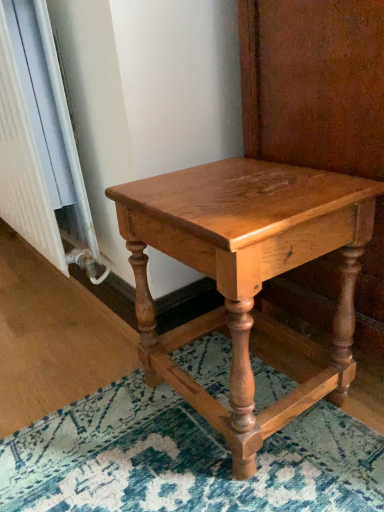
Question: Considering the positions of point (299, 385) and point (28, 139), is point (299, 385) closer or farther from the camera than point (28, 139)?

Choices:
 (A) farther
 (B) closer

Answer: (A)

Question: From a real-world perspective, is shiny oak table at center above or below white textured radiator at left?

Choices:
 (A) below
 (B) above

Answer: (A)

Question: Considering the relative positions of shiny oak table at center and white textured radiator at left in the image provided, is shiny oak table at center to the left or to the right of white textured radiator at left?

Choices:
 (A) right
 (B) left

Answer: (A)

Question: Is white textured radiator at left bigger or smaller than shiny oak table at center?

Choices:
 (A) big
 (B) small

Answer: (A)

Question: Is point (16, 190) positioned closer to the camera than point (226, 184)?

Choices:
 (A) closer
 (B) farther

Answer: (B)

Question: Is white textured radiator at left taller or shorter than shiny oak table at center?

Choices:
 (A) tall
 (B) short

Answer: (A)

Question: Considering the positions of white textured radiator at left and shiny oak table at center in the image, is white textured radiator at left wider or thinner than shiny oak table at center?

Choices:
 (A) thin
 (B) wide

Answer: (A)